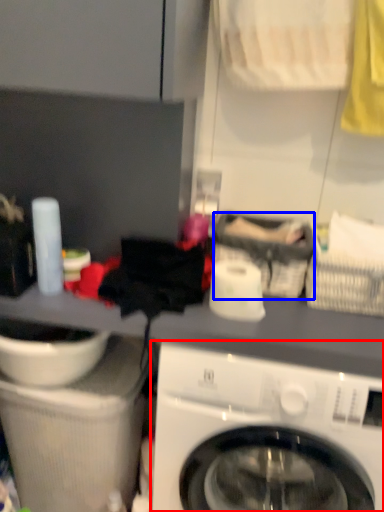
Question: Which object is further to the camera taking this photo, washing machine (highlighted by a red box) or basket (highlighted by a blue box)?

Choices:
 (A) washing machine
 (B) basket

Answer: (B)